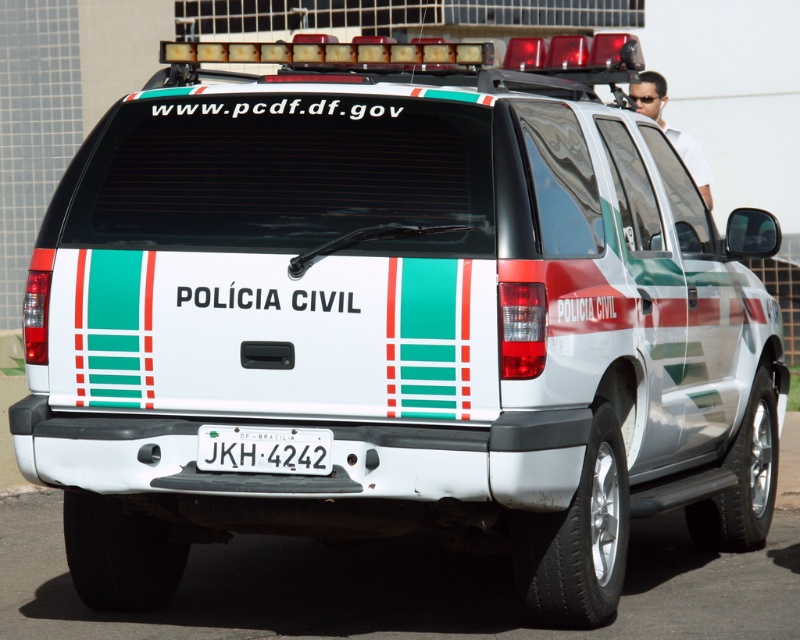
Question: Which object is farther from the camera taking this photo?

Choices:
 (A) white shirt at upper right
 (B) white plastic license plate at center

Answer: (A)

Question: Does white plastic license plate at center come behind white shirt at upper right?

Choices:
 (A) no
 (B) yes

Answer: (A)

Question: Which object appears farthest from the camera in this image?

Choices:
 (A) white plastic license plate at center
 (B) white shirt at upper right

Answer: (B)

Question: Which point is farther from the camera taking this photo?

Choices:
 (A) click(701, 172)
 (B) click(290, 458)

Answer: (A)

Question: In this image, where is white plastic license plate at center located relative to white shirt at upper right?

Choices:
 (A) below
 (B) above

Answer: (A)

Question: Is white plastic license plate at center thinner than white shirt at upper right?

Choices:
 (A) no
 (B) yes

Answer: (A)